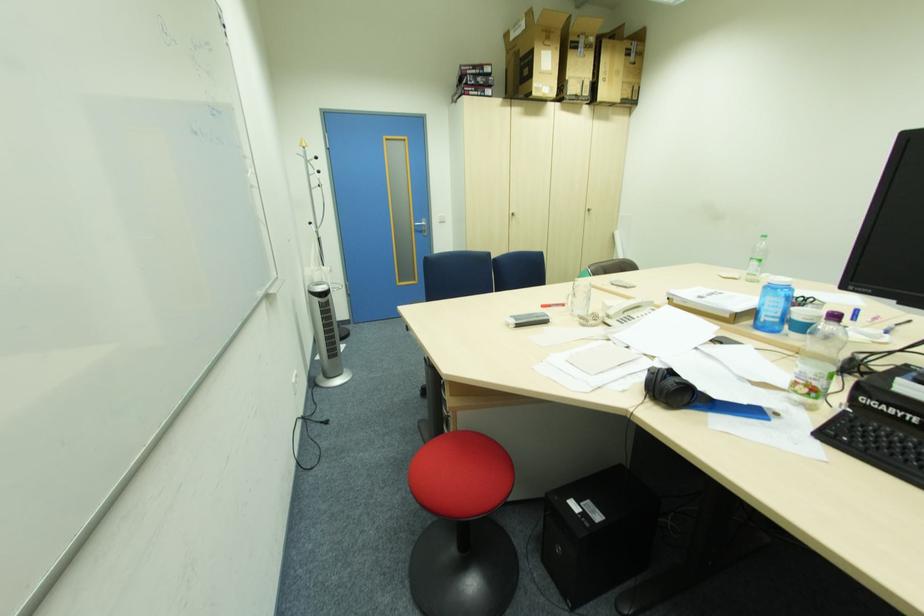
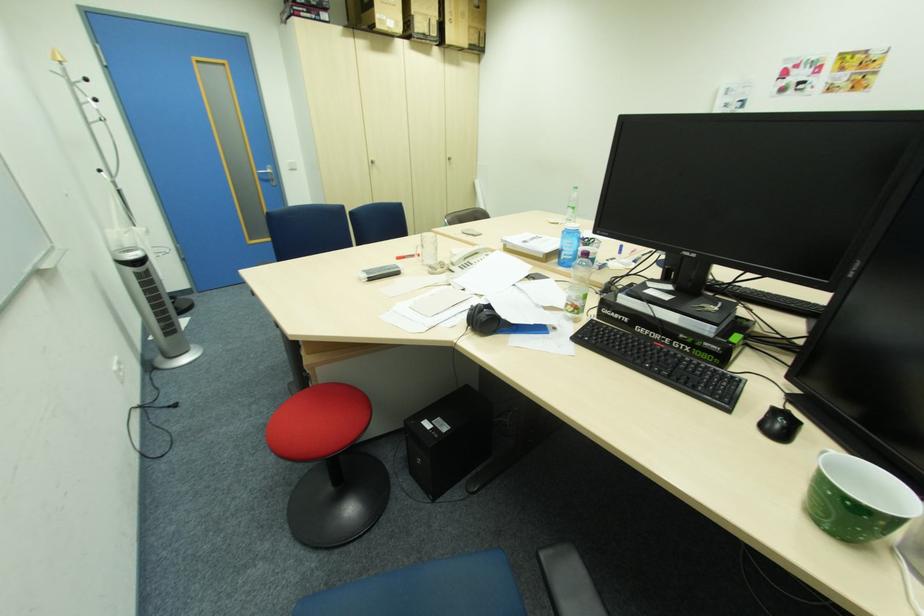
Find the pixel in the second image that matches (634,315) in the first image.

(475, 262)